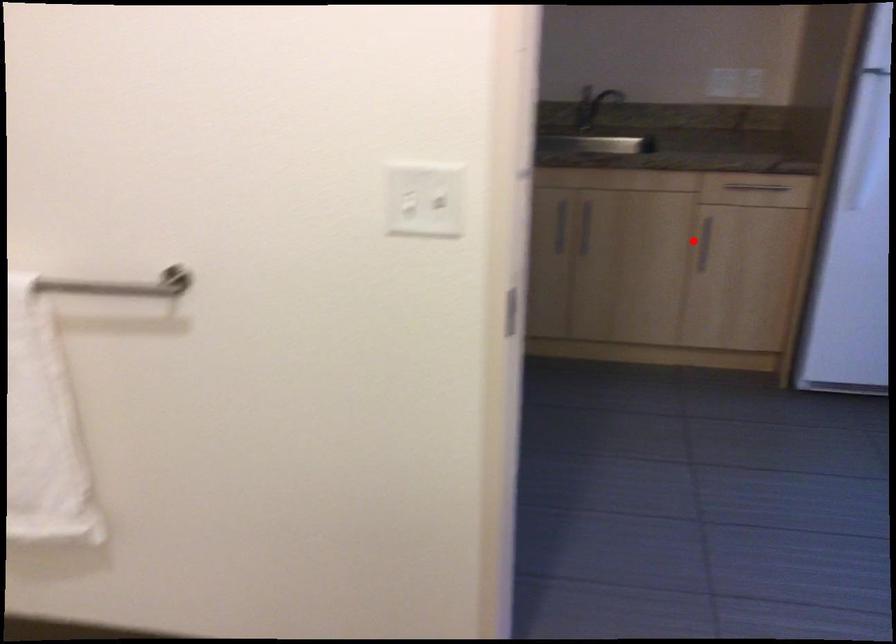
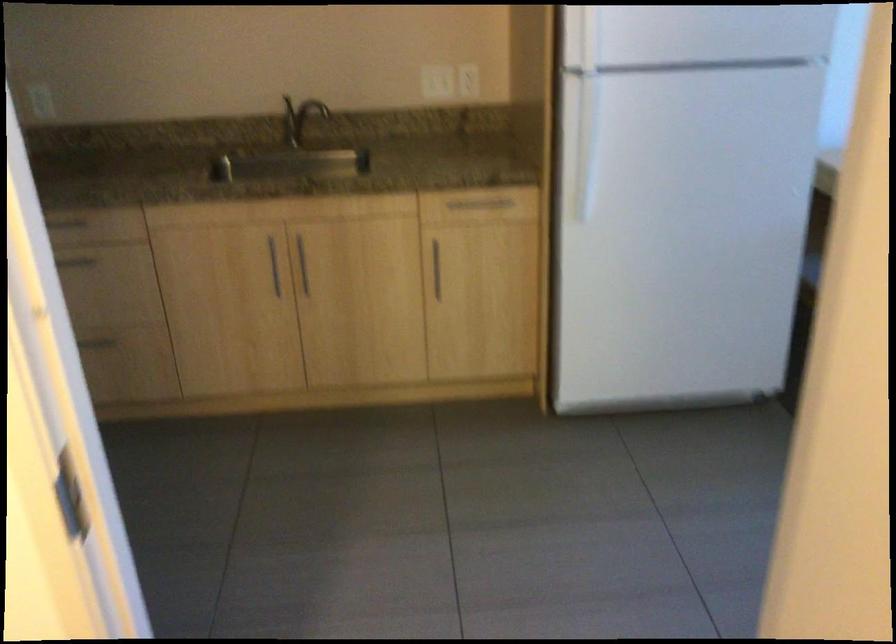
Question: I am providing you with two images of the same scene from different viewpoints. Image1 has a red point marked. In image2, the corresponding 3D location appears at what relative position? Reply with the corresponding letter.

Choices:
 (A) Closer
 (B) Farther

Answer: (A)